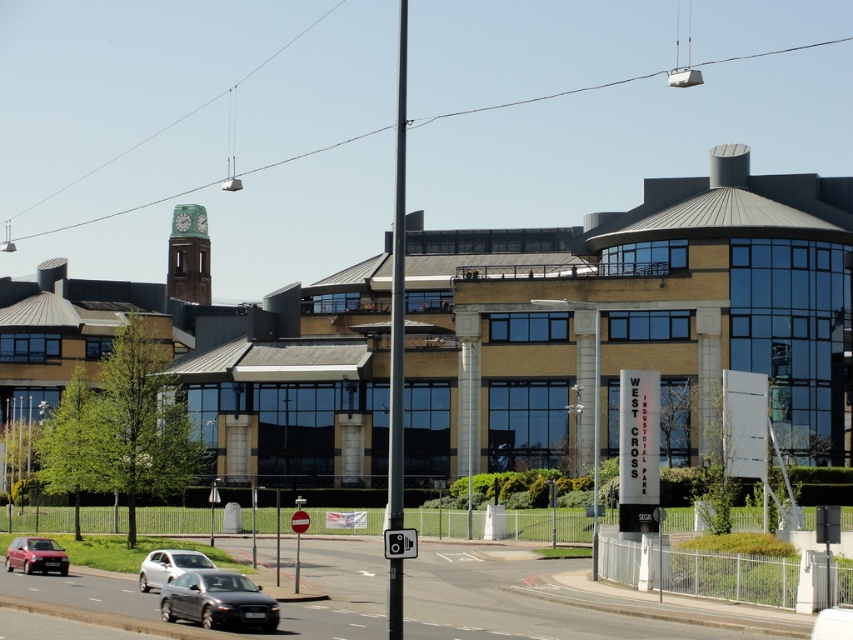
Who is more distant from viewer, (210, 572) or (44, 538)?

The point (44, 538) is behind.

Does point (166, 609) come farther from viewer compared to point (67, 566)?

No, (166, 609) is in front of (67, 566).

What do you see at coordinates (218, 600) in the screenshot?
I see `dark gray metallic car at lower center` at bounding box center [218, 600].

I want to click on dark gray metallic car at lower center, so click(218, 600).

Who is shorter, silver metallic hatchback at lower left or silver metallic sedan at lower left?

silver metallic hatchback at lower left

Where is `silver metallic hatchback at lower left`? This screenshot has width=853, height=640. silver metallic hatchback at lower left is located at coordinates (35, 556).

In the scene shown: Is dark gray metallic car at lower center taller than silver metallic sedan at lower left?

In fact, dark gray metallic car at lower center may be shorter than silver metallic sedan at lower left.

Which is in front, point (199, 596) or point (155, 556)?

Point (199, 596)

The height and width of the screenshot is (640, 853). I want to click on dark gray metallic car at lower center, so pos(218,600).